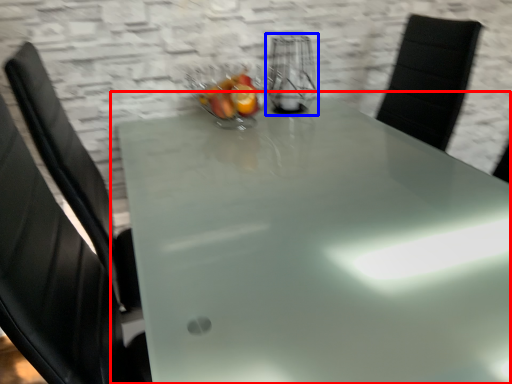
Question: Which object is further to the camera taking this photo, table (highlighted by a red box) or appliance (highlighted by a blue box)?

Choices:
 (A) table
 (B) appliance

Answer: (B)